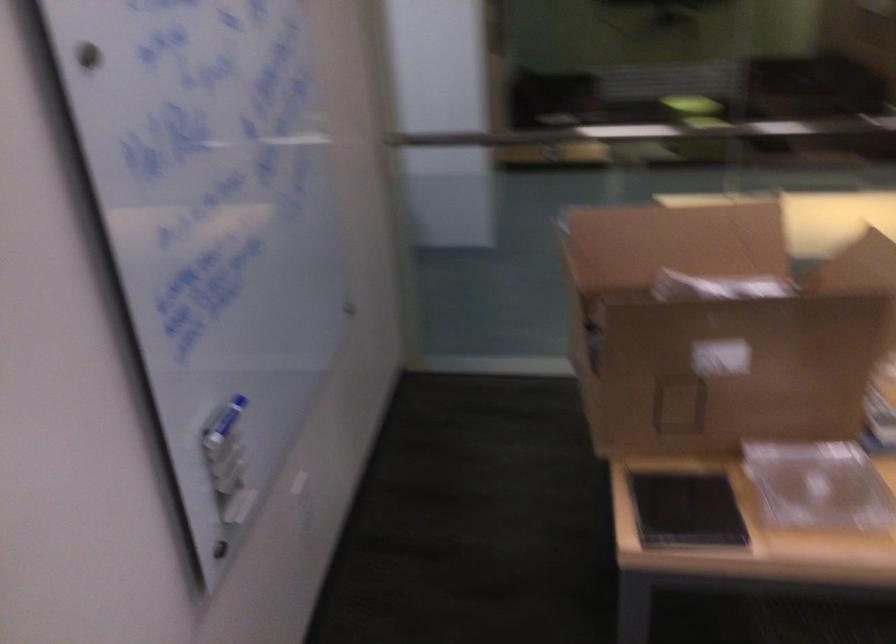
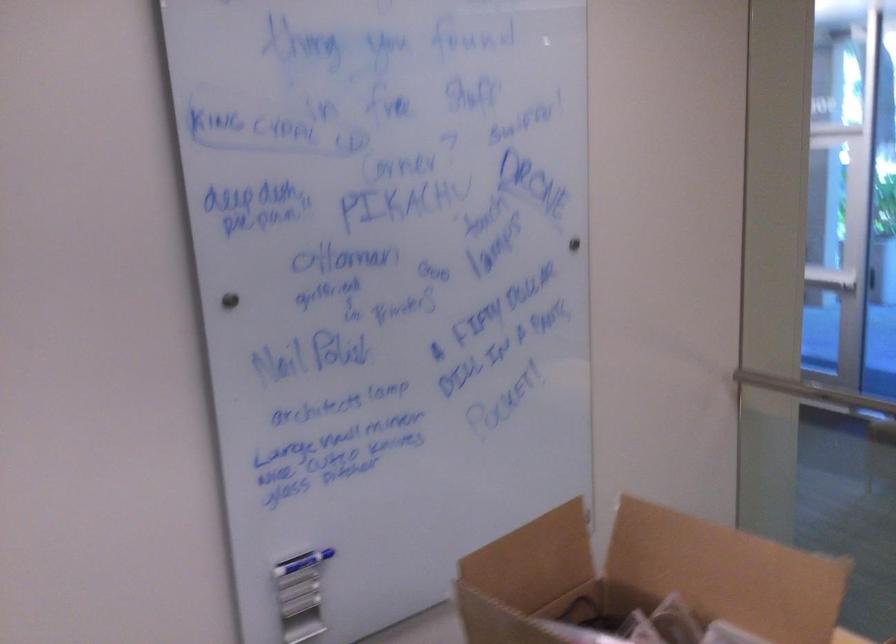
Question: Based on the continuous images, in which direction is the camera rotating? Reply with the corresponding letter.

Choices:
 (A) Left
 (B) Right
 (C) Up
 (D) Down

Answer: (A)